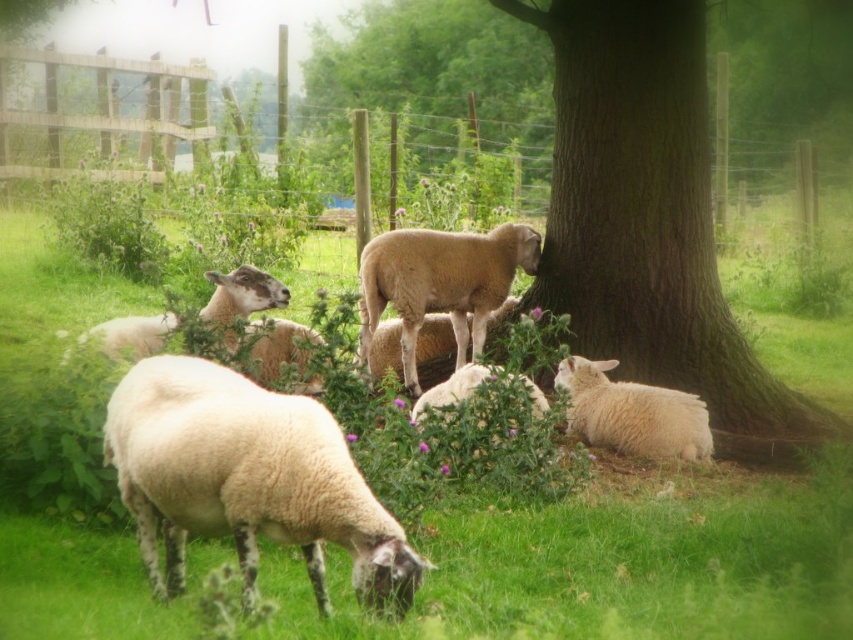
Is green rough bark tree at center bigger than wire mesh fence at center?

No.

Image resolution: width=853 pixels, height=640 pixels. What do you see at coordinates (650, 220) in the screenshot?
I see `green rough bark tree at center` at bounding box center [650, 220].

Does point (750, 429) lie behind point (759, 164)?

That is False.

In order to click on green rough bark tree at center in this screenshot , I will do `click(650, 220)`.

What do you see at coordinates (650, 220) in the screenshot? The width and height of the screenshot is (853, 640). I see `green rough bark tree at center` at bounding box center [650, 220].

Is green rough bark tree at center above white woolly sheep at lower left?

Yes, green rough bark tree at center is above white woolly sheep at lower left.

Who is more forward, (631, 262) or (393, 534)?

Positioned in front is point (393, 534).

Find the location of a particular element. green rough bark tree at center is located at coordinates (650, 220).

Is white woolly sheep at lower left below fuzzy white sheep at center?

Yes.

Between point (161, 486) and point (405, 252), which one is positioned in front?

Point (161, 486) is more forward.

Identify the location of white woolly sheep at lower left. (247, 480).

This screenshot has height=640, width=853. Find the location of `white woolly sheep at lower left`. white woolly sheep at lower left is located at coordinates (247, 480).